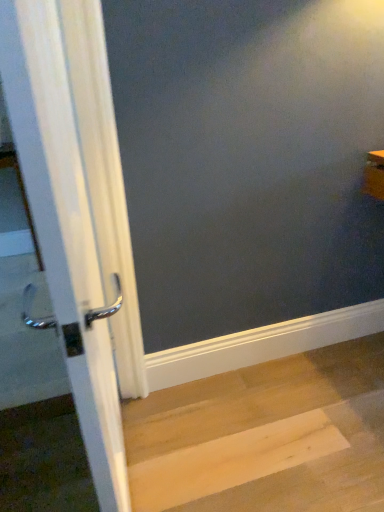
The height and width of the screenshot is (512, 384). I want to click on free point behind white glossy door handle at left, so click(x=175, y=414).